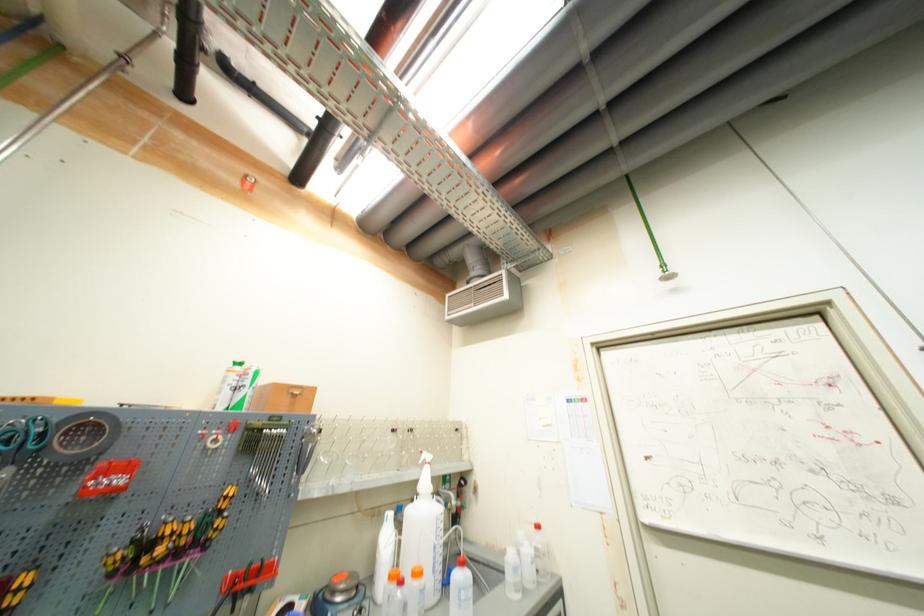
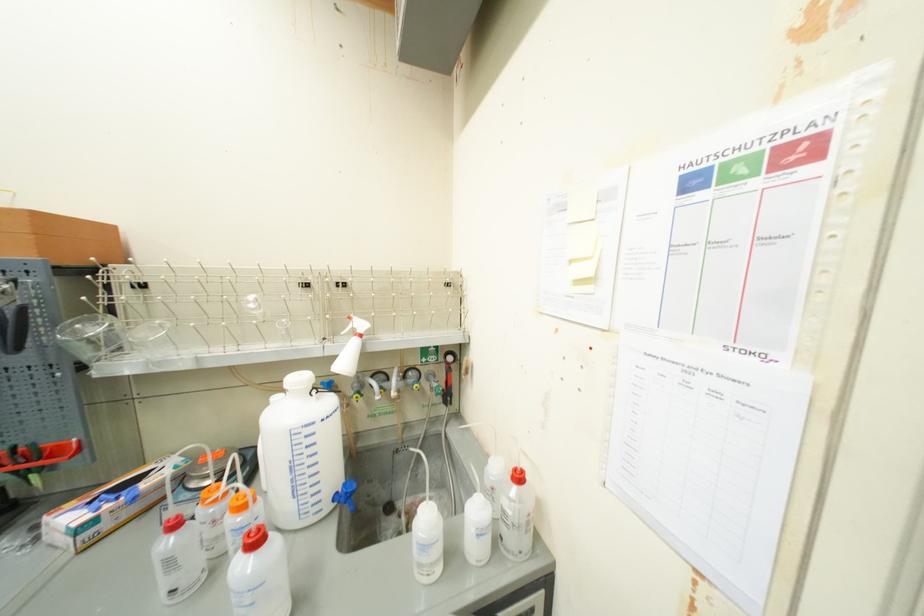
Find the pixel in the second image that matches point (538, 565) in the first image.

(483, 538)